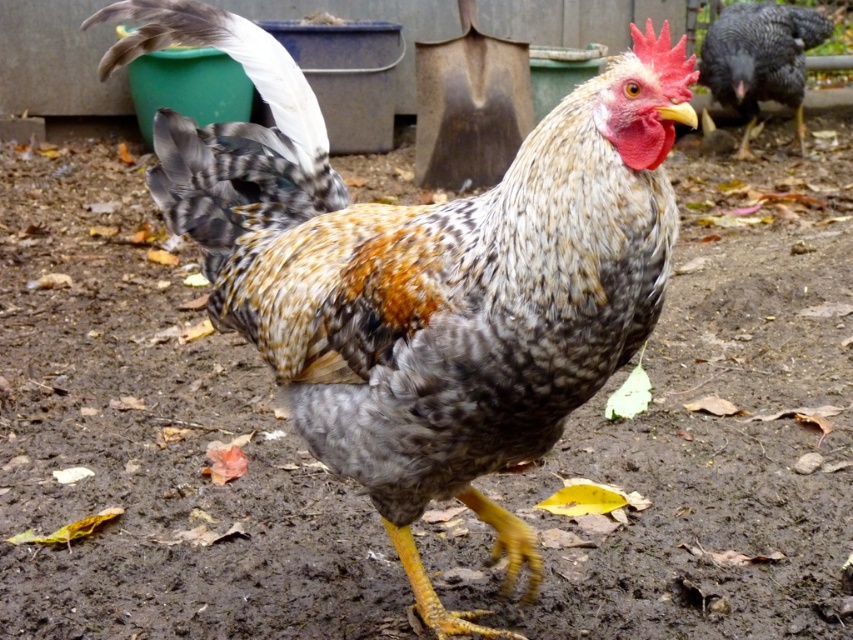
Is point (474, 432) positioned in front of point (779, 45)?

Yes.

The image size is (853, 640). I want to click on speckled feathered rooster at center, so click(425, 275).